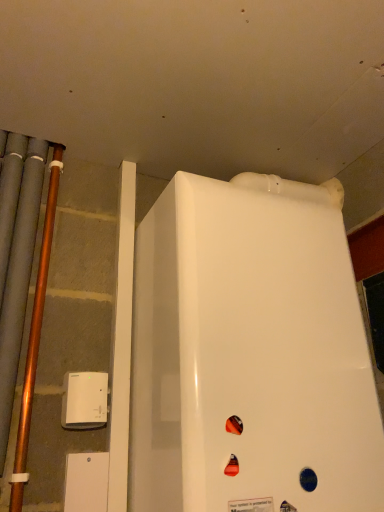
In order to face white plastic device at lower left, should I rotate leftwards or rightwards?

Turn left by 13.822 degrees to look at white plastic device at lower left.

Find the location of a particular element. white plastic device at lower left is located at coordinates (84, 400).

Relative to white glossy refrigerator at center, is white plastic device at lower left in front or behind?

Clearly, white plastic device at lower left is behind white glossy refrigerator at center.

Is white plastic device at lower left taller than white glossy refrigerator at center?

No.

Could you tell me if white plastic device at lower left is turned towards white glossy refrigerator at center?

No, white plastic device at lower left is not turned towards white glossy refrigerator at center.

Is white plastic device at lower left in contact with white glossy refrigerator at center?

There is a gap between white plastic device at lower left and white glossy refrigerator at center.

From their relative heights in the image, would you say copper metallic pipe at left is taller or shorter than white plastic device at lower left?

In the image, copper metallic pipe at left appears to be taller than white plastic device at lower left.

Can white plastic device at lower left be found inside copper metallic pipe at left?

No, white plastic device at lower left is located outside of copper metallic pipe at left.

Is copper metallic pipe at left positioned with its back to white plastic device at lower left?

That's not correct — copper metallic pipe at left is not looking away from white plastic device at lower left.

From a real-world perspective, is copper metallic pipe at left above or below white plastic device at lower left?

From a real-world perspective, copper metallic pipe at left is physically above white plastic device at lower left.

Does white glossy refrigerator at center have a larger size compared to copper metallic pipe at left?

Correct, white glossy refrigerator at center is larger in size than copper metallic pipe at left.

Can we say white glossy refrigerator at center lies outside copper metallic pipe at left?

Indeed, white glossy refrigerator at center is completely outside copper metallic pipe at left.

Is white glossy refrigerator at center facing towards copper metallic pipe at left?

No, white glossy refrigerator at center is not turned towards copper metallic pipe at left.

Between white glossy refrigerator at center and copper metallic pipe at left, which one appears on the right side from the viewer's perspective?

white glossy refrigerator at center is more to the right.

Can you tell me how much white plastic device at lower left and copper metallic pipe at left differ in facing direction?

There is a 1.48-degree angle between the facing directions of white plastic device at lower left and copper metallic pipe at left.

Consider the image. Is white plastic device at lower left at the left side of copper metallic pipe at left?

No, white plastic device at lower left is not to the left of copper metallic pipe at left.

From a real-world perspective, who is located higher, white plastic device at lower left or copper metallic pipe at left?

copper metallic pipe at left is physically above.

Does white plastic device at lower left have a larger size compared to copper metallic pipe at left?

Incorrect, white plastic device at lower left is not larger than copper metallic pipe at left.

Looking at this image, from the image's perspective, is white glossy refrigerator at center below white plastic device at lower left?

No.

Measure the distance between white glossy refrigerator at center and white plastic device at lower left.

white glossy refrigerator at center is 14.01 inches away from white plastic device at lower left.

What are the coordinates of `refrigerator that is in front of the white plastic device at lower left` in the screenshot? It's located at (250, 352).

From a real-world perspective, is white glossy refrigerator at center beneath white plastic device at lower left?

Actually, white glossy refrigerator at center is physically above white plastic device at lower left in the real world.

Which object is closer to the camera taking this photo, copper metallic pipe at left or white glossy refrigerator at center?

white glossy refrigerator at center is closer to the camera.

Considering the positions of point (56, 167) and point (176, 227), is point (56, 167) closer or farther from the camera than point (176, 227)?

Point (56, 167) appears to be farther away from the viewer than point (176, 227).

Based on their sizes in the image, would you say copper metallic pipe at left is bigger or smaller than white glossy refrigerator at center?

In the image, copper metallic pipe at left appears to be smaller than white glossy refrigerator at center.

Image resolution: width=384 pixels, height=512 pixels. I want to click on refrigerator below the copper metallic pipe at left (from the image's perspective), so click(250, 352).

You are a GUI agent. You are given a task and a screenshot of the screen. Output one action in this format:
    pyautogui.click(x=<x>, y=<y>)
    Task: Click on the appliance below the white glossy refrigerator at center (from the image's perspective)
    The width and height of the screenshot is (384, 512).
    Given the screenshot: What is the action you would take?
    pyautogui.click(x=84, y=400)

At what (x,y) coordinates should I click in order to perform the action: click on appliance on the right of copper metallic pipe at left. Please return your answer as a coordinate pair (x, y). The width and height of the screenshot is (384, 512). Looking at the image, I should click on 84,400.

From the image, which object appears to be nearer to white glossy refrigerator at center, copper metallic pipe at left or white plastic device at lower left?

Among the two, white plastic device at lower left is located nearer to white glossy refrigerator at center.

When comparing their distances from white plastic device at lower left, does white glossy refrigerator at center or copper metallic pipe at left seem further?

white glossy refrigerator at center is positioned further to the anchor white plastic device at lower left.

Consider the image. Considering their positions, is white glossy refrigerator at center positioned further to copper metallic pipe at left than white plastic device at lower left?

white glossy refrigerator at center.

Consider the image. Considering their positions, is white plastic device at lower left positioned further to copper metallic pipe at left than white glossy refrigerator at center?

Based on the image, white glossy refrigerator at center appears to be further to copper metallic pipe at left.

Considering their positions, is copper metallic pipe at left positioned further to white plastic device at lower left than white glossy refrigerator at center?

The object further to white plastic device at lower left is white glossy refrigerator at center.

From the image, which object appears to be farther from white glossy refrigerator at center, white plastic device at lower left or copper metallic pipe at left?

Among the two, copper metallic pipe at left is located further to white glossy refrigerator at center.

What are the coordinates of `appliance located between copper metallic pipe at left and white glossy refrigerator at center in the left-right direction` in the screenshot? It's located at (84, 400).